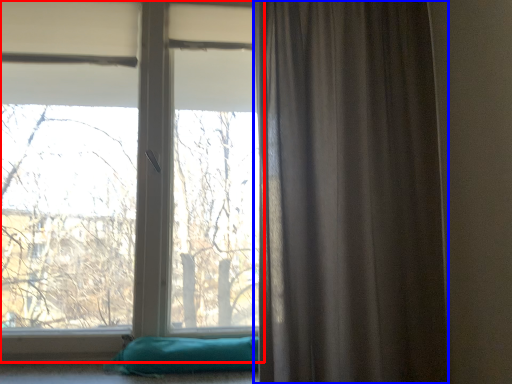
Question: Which point is further to the camera, window (highlighted by a red box) or curtain (highlighted by a blue box)?

Choices:
 (A) window
 (B) curtain

Answer: (A)